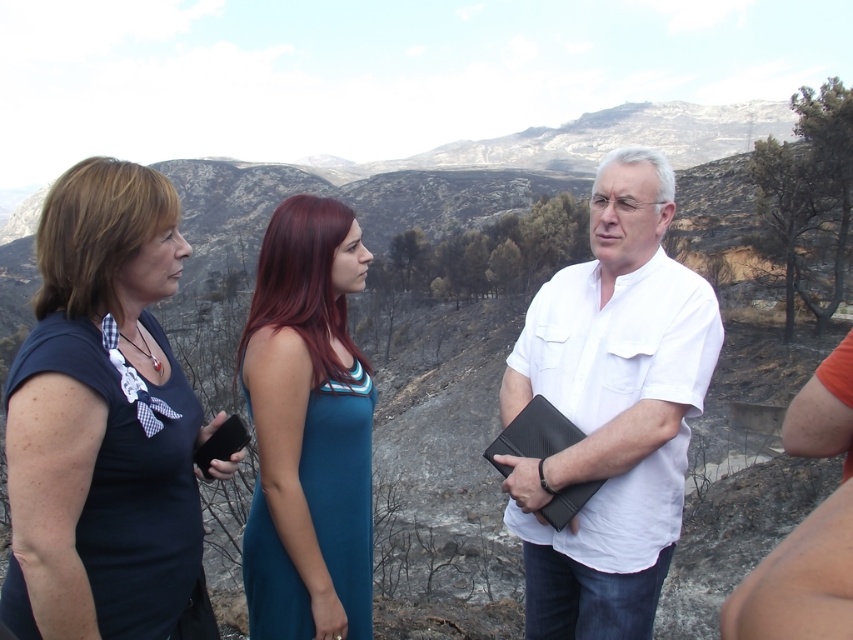
Between point (59, 248) and point (550, 605), which one is positioned in front?

Point (59, 248) is more forward.

Which is behind, point (61, 356) or point (509, 509)?

The point (509, 509) is behind.

Image resolution: width=853 pixels, height=640 pixels. Describe the element at coordinates (103, 420) in the screenshot. I see `matte black shirt at center` at that location.

Identify the location of matte black shirt at center. The image size is (853, 640). (103, 420).

Which is above, matte black shirt at center or teal satin dress at center?

Result: matte black shirt at center

Does matte black shirt at center have a lesser height compared to teal satin dress at center?

Yes.

This screenshot has height=640, width=853. Describe the element at coordinates (103, 420) in the screenshot. I see `matte black shirt at center` at that location.

This screenshot has width=853, height=640. What are the coordinates of `matte black shirt at center` in the screenshot? It's located at (103, 420).

Which is below, white matte shirt at center or teal satin dress at center?

teal satin dress at center is below.

How much distance is there between white matte shirt at center and teal satin dress at center?

They are 11.55 meters apart.

Find the location of `white matte shirt at center`. white matte shirt at center is located at coordinates tap(610, 410).